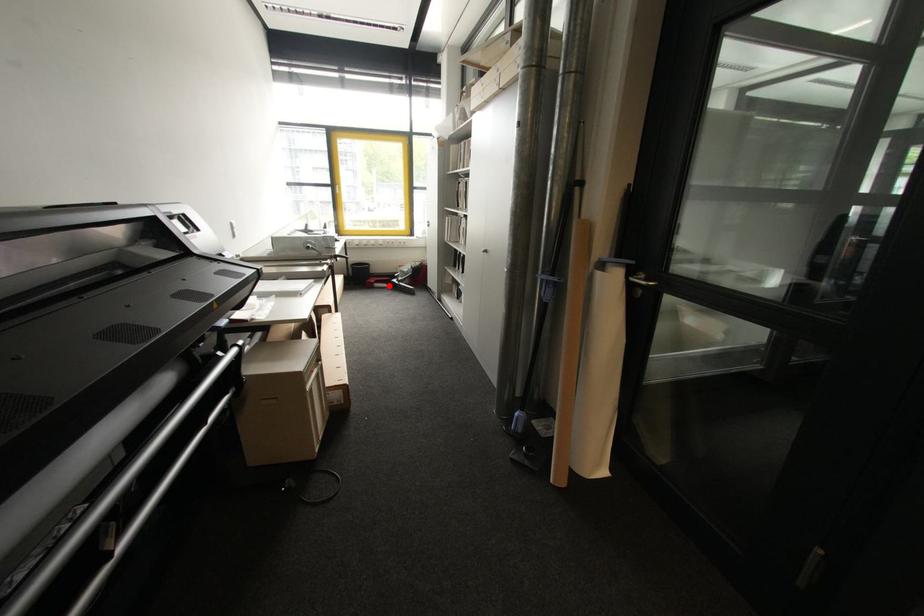
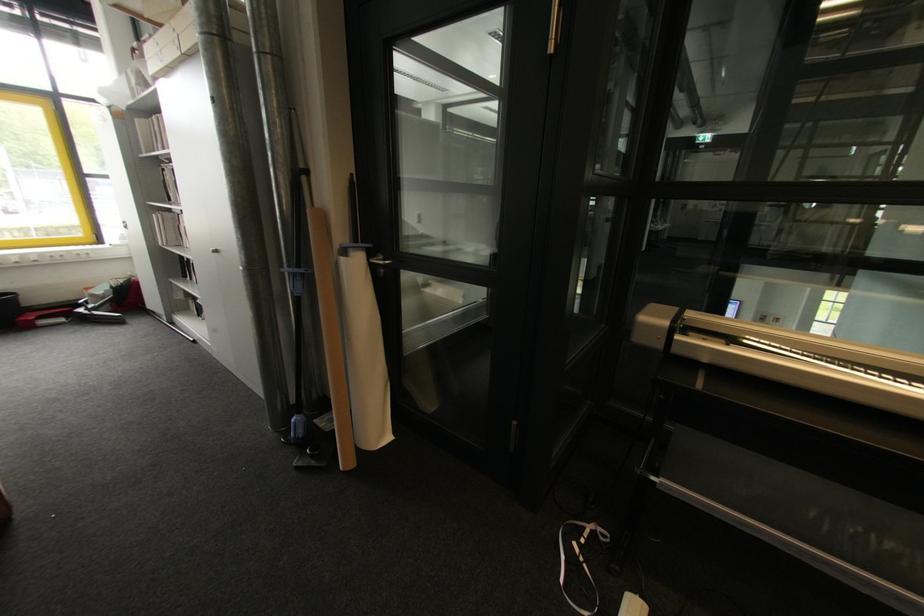
Where in the second image is the point corresponding to the highlighted location from the first image?

(66, 321)